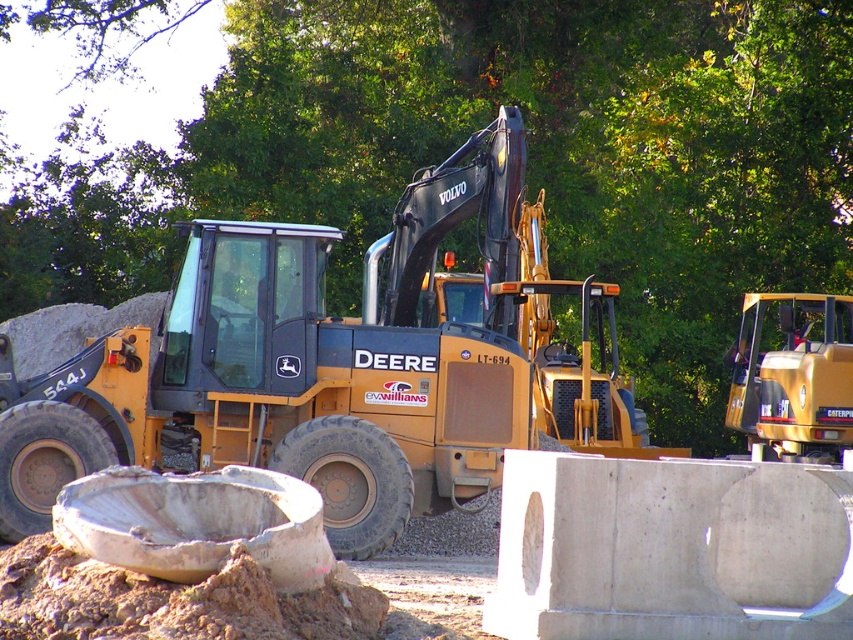
You are a construction worker who needs to place a 2m wide container between the brown sandy dirt at lower left and the yellow metallic tractor at right. Can you fit it there?

The brown sandy dirt at lower left might be wider than yellow metallic tractor at right, so there might be enough space to fit the 2m wide container between them.

You are a construction worker standing at the edge of the construction site. You need to move materials from the gray concrete at center to the yellow metallic tractor at right. Which object is closer to your starting position?

The gray concrete at center is closer to the viewer than the yellow metallic tractor at right, so the gray concrete at center is closer to your starting position.

You are a construction worker standing at the center of the construction site. You need to locate the brown sandy dirt at lower left. According to the coordinates given, where exactly should you look to find it?

The brown sandy dirt at lower left is located at point coordinates of (183, 604).